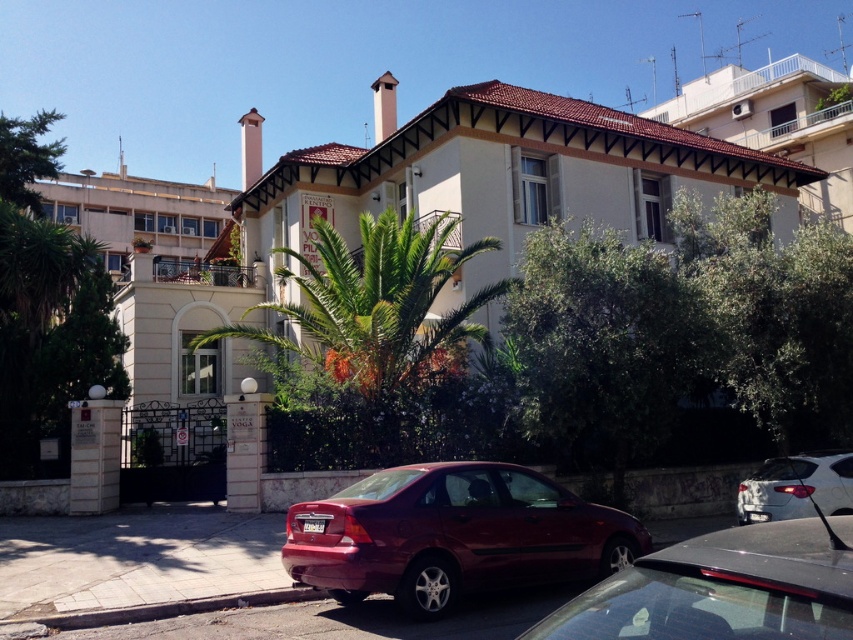
You are a delivery driver arriving at the building. You need to park your shiny black sedan at center in a spot that is not blocking the white glossy sedan at lower right. Based on the scene, is there a suitable parking spot available?

The shiny black sedan at center is in front of the white glossy sedan at lower right, so moving it would allow the white glossy sedan at lower right to exit. There is a suitable parking spot available by moving the shiny black sedan at center to another area not blocking the entrance or the white glossy sedan at lower right.

You are a delivery driver who needs to park your vehicle, which is 1.5 meters tall, in the parking area near the building. You see the shiny red sedan at lower center and the white glossy sedan at lower right. Can your vehicle fit in the parking spot if the height restriction is based on the shorter vehicle?

The shiny red sedan at lower center is taller than the white glossy sedan at lower right. Since the height restriction is based on the shorter vehicle, which is the white glossy sedan at lower right, your vehicle at 1.5 meters may or may not fit depending on the white sedan height. However, since the problem does not provide the exact height of the white sedan, we cannot determine if your vehicle can fit.

You are a delivery driver who needs to park your vehicle, which is 5 meters long, in the space between the shiny red sedan at lower center and the shiny black sedan at center. Is there enough space to park your vehicle there?

The distance between the shiny red sedan at lower center and the shiny black sedan at center is 5.65 meters. Since your vehicle is 5 meters long, there is sufficient space to park between them.